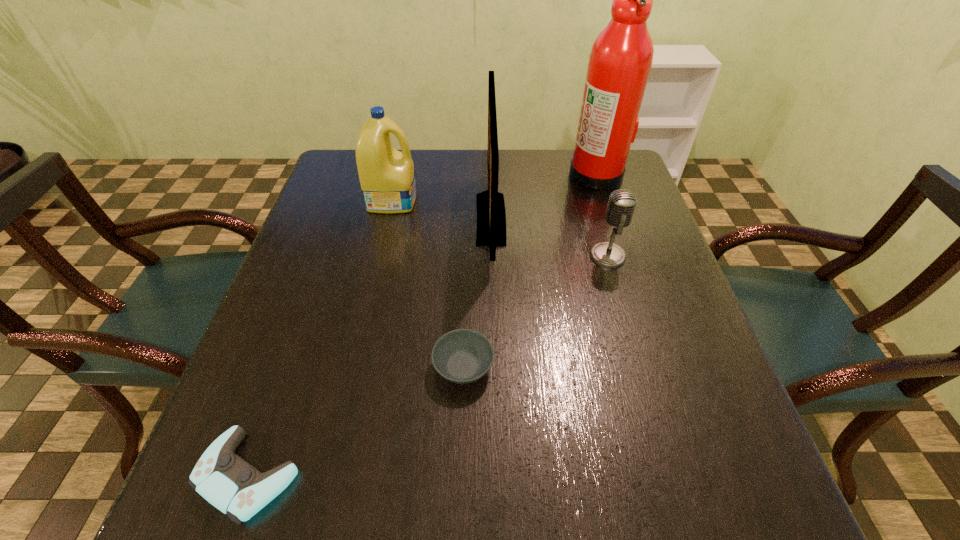
I want to click on free space located on the front-facing side of the monitor, so click(x=406, y=219).

Where is `vacant area located 0.230m on the front-facing side of the monitor`? The image size is (960, 540). vacant area located 0.230m on the front-facing side of the monitor is located at coordinates (386, 219).

The width and height of the screenshot is (960, 540). Identify the location of vacant area situated on the label of the fourth shortest object. (461, 199).

Locate an element on the screen. vacant space positioned on the back of the microphone is located at coordinates (591, 200).

In order to click on blank area located 0.320m on the back of the fifth farthest object in this screenshot , I will do `click(468, 235)`.

The height and width of the screenshot is (540, 960). I want to click on blank area located 0.320m on the right of the nearest object, so click(503, 475).

Find the location of a particular element. fire extinguisher present at the far edge is located at coordinates (620, 61).

Identify the location of monitor that is at the far edge. (491, 217).

Locate an element on the screen. The height and width of the screenshot is (540, 960). detergent at the far edge is located at coordinates (387, 178).

Where is `object that is at the near edge`? The height and width of the screenshot is (540, 960). object that is at the near edge is located at coordinates (228, 482).